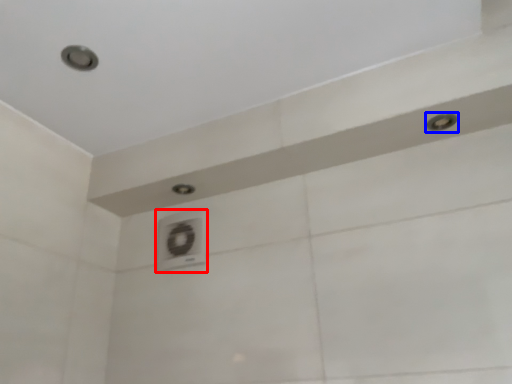
Question: Which object appears farthest to the camera in this image, air conditioner (highlighted by a red box) or shower (highlighted by a blue box)?

Choices:
 (A) air conditioner
 (B) shower

Answer: (A)